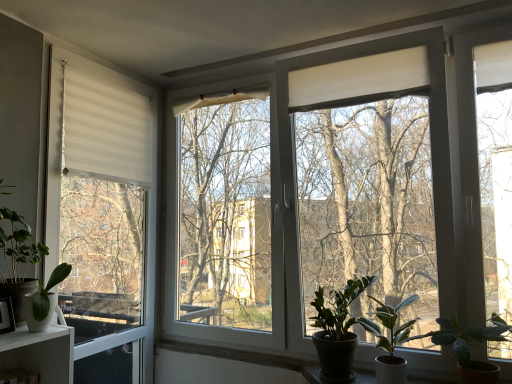
Question: Is dark green glossy plant at lower right, the third houseplant positioned from the right, smaller than green matte plant at lower right, which is the 4th houseplant in left-to-right order?

Choices:
 (A) yes
 (B) no

Answer: (A)

Question: From the image's perspective, is dark green glossy plant at lower right, the third houseplant positioned from the right, on top of green matte plant at lower right, which is the 4th houseplant in left-to-right order?

Choices:
 (A) no
 (B) yes

Answer: (A)

Question: Is dark green glossy plant at lower right, the third houseplant positioned from the right, at the left side of green matte plant at lower right, which is the 4th houseplant in left-to-right order?

Choices:
 (A) yes
 (B) no

Answer: (A)

Question: Is dark green glossy plant at lower right, the third houseplant positioned from the right, shorter than green matte plant at lower right, the second houseplant in the right-to-left sequence?

Choices:
 (A) no
 (B) yes

Answer: (A)

Question: Is dark green glossy plant at lower right, arranged as the third houseplant when viewed from the left, not inside green matte plant at lower right, which is the 4th houseplant in left-to-right order?

Choices:
 (A) yes
 (B) no

Answer: (A)

Question: Could you tell me if dark green glossy plant at lower right, the third houseplant positioned from the right, is facing green matte plant at lower right, which is the 4th houseplant in left-to-right order?

Choices:
 (A) yes
 (B) no

Answer: (B)

Question: Is green matte plant at lower right, which is the 4th houseplant in left-to-right order, aimed at white matte pot at lower left, which is counted as the second houseplant, starting from the left?

Choices:
 (A) no
 (B) yes

Answer: (A)

Question: Is green matte plant at lower right, the second houseplant in the right-to-left sequence, bigger than white matte pot at lower left, which is the 4th houseplant from right to left?

Choices:
 (A) yes
 (B) no

Answer: (A)

Question: Is green matte plant at lower right, the second houseplant in the right-to-left sequence, outside white matte pot at lower left, which is the 4th houseplant from right to left?

Choices:
 (A) yes
 (B) no

Answer: (A)

Question: Considering the relative positions of green matte plant at lower right, the second houseplant in the right-to-left sequence, and white matte pot at lower left, which is the 4th houseplant from right to left, in the image provided, is green matte plant at lower right, the second houseplant in the right-to-left sequence, to the left of white matte pot at lower left, which is the 4th houseplant from right to left, from the viewer's perspective?

Choices:
 (A) no
 (B) yes

Answer: (A)

Question: Is green matte plant at lower right, the second houseplant in the right-to-left sequence, behind white matte pot at lower left, which is counted as the second houseplant, starting from the left?

Choices:
 (A) yes
 (B) no

Answer: (A)

Question: Is green matte plant at lower right, which is the 4th houseplant in left-to-right order, positioned with its back to white matte pot at lower left, which is the 4th houseplant from right to left?

Choices:
 (A) yes
 (B) no

Answer: (B)

Question: Is green matte plant at lower right, the second houseplant in the right-to-left sequence, to the left of green matte plant at left, the 5th houseplant viewed from the right, from the viewer's perspective?

Choices:
 (A) yes
 (B) no

Answer: (B)